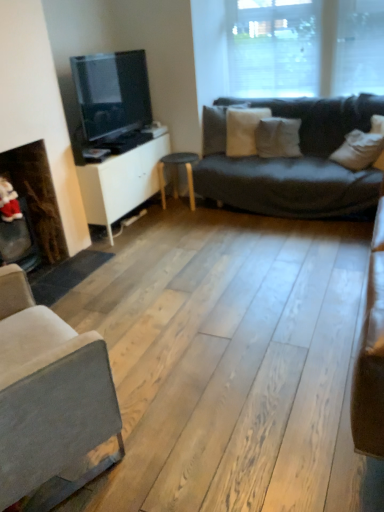
Question: Choose the correct answer: Is matte black tv at left inside dark brown wood fireplace at left or outside it?

Choices:
 (A) outside
 (B) inside

Answer: (A)

Question: Is matte black tv at left taller or shorter than dark brown wood fireplace at left?

Choices:
 (A) tall
 (B) short

Answer: (A)

Question: Which object is positioned farthest from the white soft pillow at center, the 2th pillow from the right?

Choices:
 (A) white soft pillow at center, which is the 3th pillow in right-to-left order
 (B) white matte cabinet at center
 (C) matte black stool at center
 (D) dark brown wood fireplace at left
 (E) light gray fabric couch at lower left

Answer: (E)

Question: Which of these objects is positioned farthest from the white soft pillow at center, the 2th pillow from the right?

Choices:
 (A) white soft pillow at upper right, the first pillow viewed from the right
 (B) white matte cabinet at center
 (C) dark brown wood fireplace at left
 (D) matte black stool at center
 (E) white soft pillow at center, which is the 3th pillow in right-to-left order

Answer: (C)